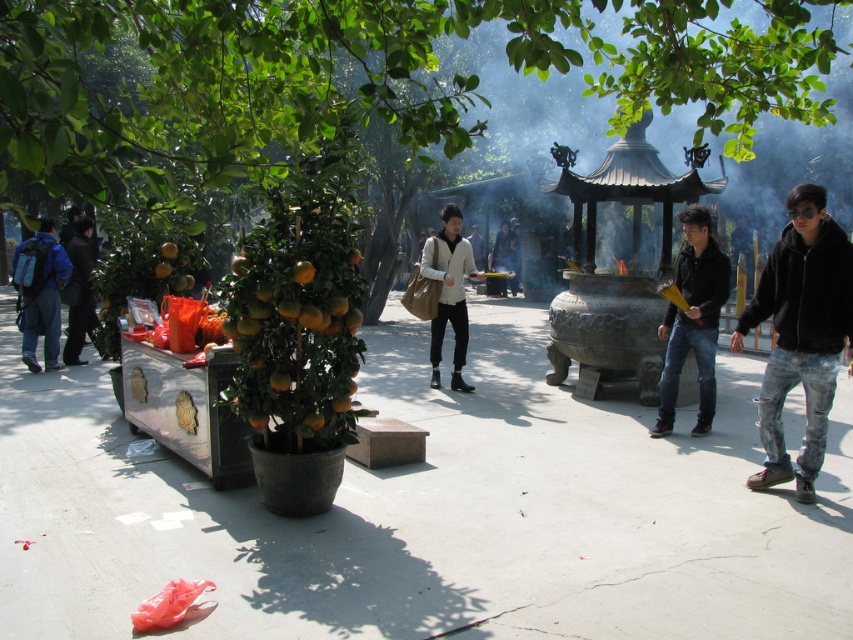
The height and width of the screenshot is (640, 853). I want to click on green glossy tree at center, so click(360, 76).

Is point (21, 38) less distant than point (801, 289)?

Yes, point (21, 38) is closer to viewer.

Locate an element on the screen. This screenshot has width=853, height=640. green glossy tree at center is located at coordinates (360, 76).

Who is taller, green glossy tree at center or matte blue backpack at left?

Standing taller between the two is green glossy tree at center.

Between green glossy tree at center and matte blue backpack at left, which one is positioned lower?

matte blue backpack at left is below.

Locate an element on the screen. Image resolution: width=853 pixels, height=640 pixels. green glossy tree at center is located at coordinates (360, 76).

The image size is (853, 640). Find the location of `green glossy tree at center`. green glossy tree at center is located at coordinates (360, 76).

Is black fuzzy jacket at right bigger than matte beige jacket at center?

No, black fuzzy jacket at right is not bigger than matte beige jacket at center.

The height and width of the screenshot is (640, 853). What do you see at coordinates (799, 333) in the screenshot?
I see `black fuzzy jacket at right` at bounding box center [799, 333].

Locate an element on the screen. This screenshot has width=853, height=640. black fuzzy jacket at right is located at coordinates (799, 333).

Find the location of a particular element. The image size is (853, 640). black fuzzy jacket at right is located at coordinates (799, 333).